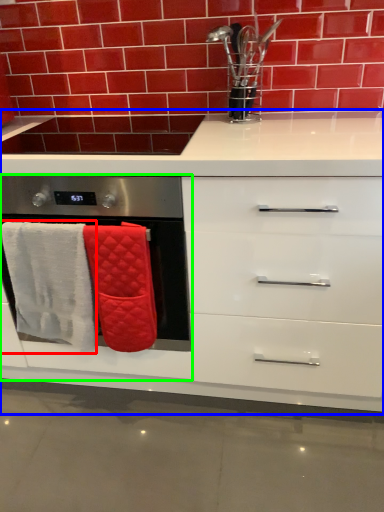
Question: Which is farther away from bath towel (highlighted by a red box)? cabinetry (highlighted by a blue box) or oven (highlighted by a green box)?

Choices:
 (A) cabinetry
 (B) oven

Answer: (A)